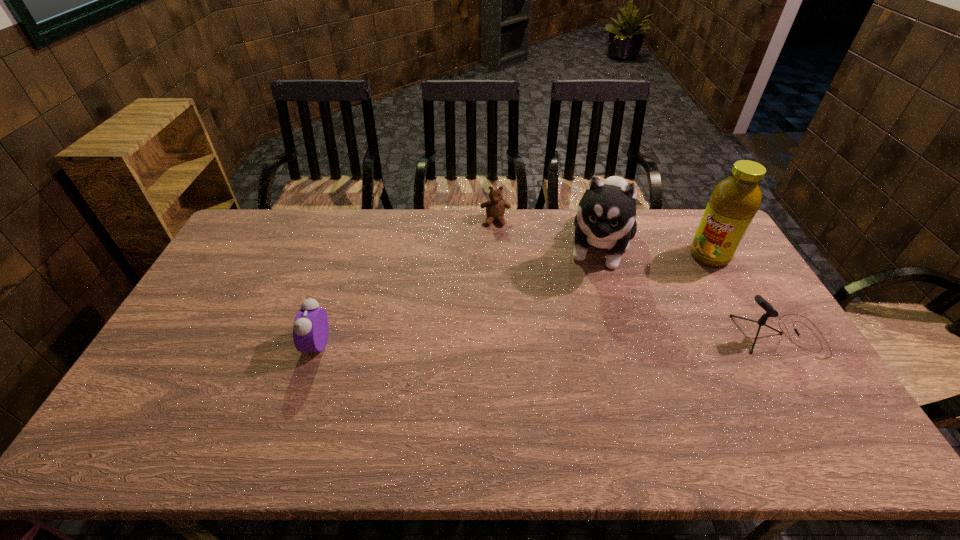
Locate an element on the screen. This screenshot has width=960, height=540. vacant space situated at the face of the puppy is located at coordinates (581, 336).

Find the location of a particular element. vacant space situated 0.100m on the front label of the fruit juice is located at coordinates (683, 278).

Find the location of `vacant position located on the front label of the fruit juice`. vacant position located on the front label of the fruit juice is located at coordinates (638, 313).

You are a GUI agent. You are given a task and a screenshot of the screen. Output one action in this format:
    pyautogui.click(x=<x>, y=<y>)
    Task: Click on the free region located 0.250m on the front label of the fruit juice
    Image resolution: width=960 pixels, height=540 pixels.
    Given the screenshot: What is the action you would take?
    pyautogui.click(x=656, y=299)

You are a GUI agent. You are given a task and a screenshot of the screen. Output one action in this format:
    pyautogui.click(x=<x>, y=<y>)
    Task: Click on the blank space located on the front-facing side of the fourth object from right to left
    The width and height of the screenshot is (960, 540).
    Given the screenshot: What is the action you would take?
    pyautogui.click(x=493, y=283)

At what (x,y) coordinates should I click in order to perform the action: click on vacant region located 0.160m on the front-facing side of the fourth object from right to left. Please return your answer as a coordinate pair (x, y). This screenshot has height=540, width=960. Looking at the image, I should click on (494, 256).

This screenshot has height=540, width=960. I want to click on vacant space situated on the front-facing side of the fourth object from right to left, so click(494, 274).

Identify the location of puppy that is at the far edge. The image size is (960, 540). (605, 218).

Find the location of `fruit juice that is at the far edge`. fruit juice that is at the far edge is located at coordinates (733, 203).

Where is `teddy bear that is positioned at the far edge`? The image size is (960, 540). teddy bear that is positioned at the far edge is located at coordinates (495, 208).